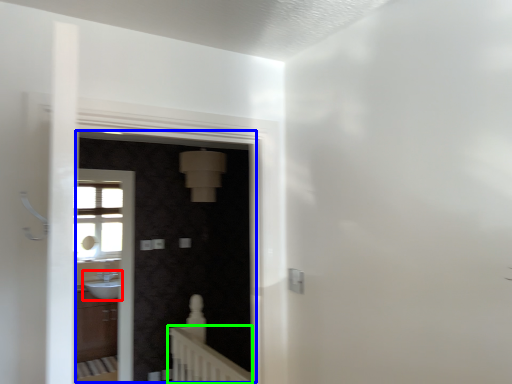
Question: Which is nearer to the sink (highlighted by a red box)? screen door (highlighted by a blue box) or balustrade (highlighted by a green box).

Choices:
 (A) screen door
 (B) balustrade

Answer: (A)